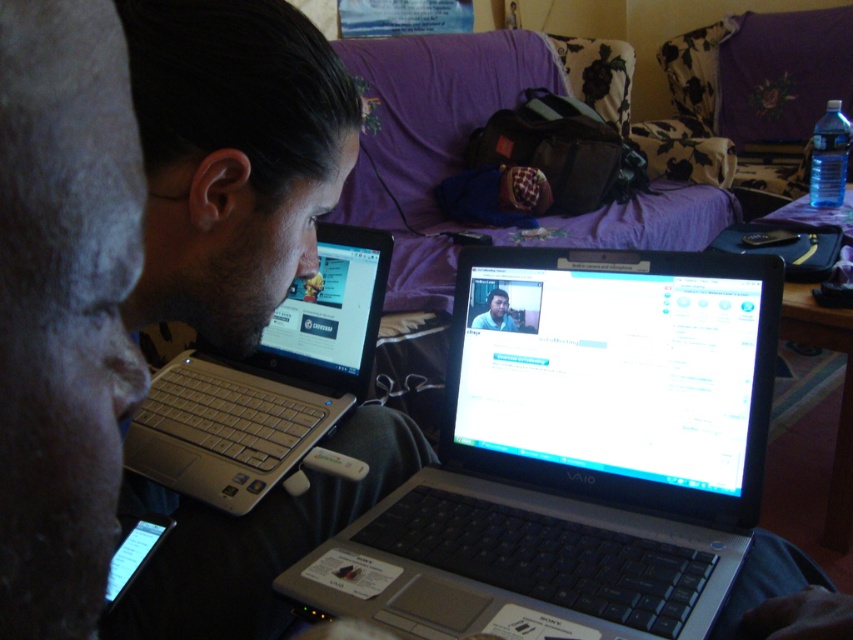
Does silver metallic laptop at left have a smaller size compared to matte black laptop at center?

Incorrect, silver metallic laptop at left is not smaller in size than matte black laptop at center.

Between silver metallic laptop at left and matte black laptop at center, which one appears on the right side from the viewer's perspective?

matte black laptop at center is more to the right.

Between point (332, 292) and point (482, 316), which one is positioned in front?

Point (482, 316) is in front.

The image size is (853, 640). In order to click on silver metallic laptop at left in this screenshot , I will do `click(267, 384)`.

Between black plastic laptop at center and matte black laptop at center, which one appears on the right side from the viewer's perspective?

From the viewer's perspective, black plastic laptop at center appears more on the right side.

Does point (640, 413) lie behind point (509, 314)?

No, (640, 413) is closer to viewer.

From the picture: Measure the distance between point (614, 420) and camera.

Point (614, 420) and camera are 29.47 inches apart.

At what (x,y) coordinates should I click in order to perform the action: click on black plastic laptop at center. Please return your answer as a coordinate pair (x, y). Looking at the image, I should click on (577, 454).

Can you confirm if black plastic laptop at center is positioned above matte silver laptop at left?

No.

Identify the location of black plastic laptop at center. (577, 454).

The height and width of the screenshot is (640, 853). Identify the location of black plastic laptop at center. (577, 454).